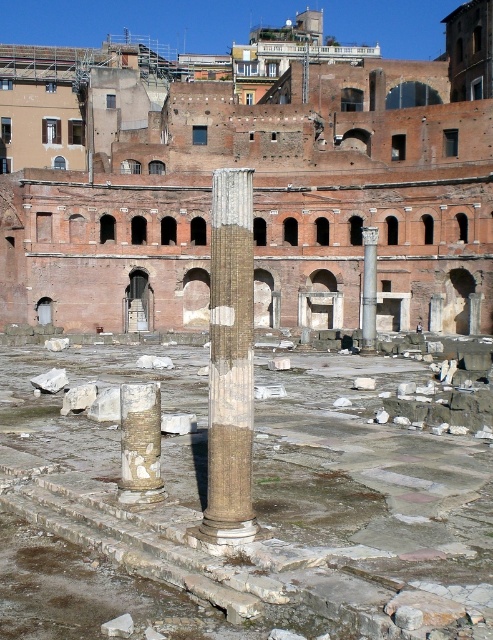
Does brown stone column at center appear on the right side of speckled stone column at center?

Yes, brown stone column at center is to the right of speckled stone column at center.

Does brown stone column at center have a smaller size compared to speckled stone column at center?

No, brown stone column at center is not smaller than speckled stone column at center.

Is point (220, 179) farther from camera compared to point (125, 410)?

No.

Image resolution: width=493 pixels, height=640 pixels. Identify the location of brown stone column at center. (231, 362).

Can you confirm if speckled stone column at center is shorter than smooth stone column at center?

Correct, speckled stone column at center is not as tall as smooth stone column at center.

Between point (155, 474) and point (364, 301), which one is positioned behind?

Positioned behind is point (364, 301).

Which is in front, point (148, 484) or point (367, 282)?

Point (148, 484) is in front.

I want to click on speckled stone column at center, so click(x=140, y=444).

Between point (157, 198) and point (124, 417), which one is positioned in front?

Point (124, 417)

Is brown stone amphitheater at center positioned at the back of speckled stone column at center?

That is True.

Locate an element on the screen. brown stone amphitheater at center is located at coordinates (270, 192).

Locate an element on the screen. This screenshot has width=493, height=640. brown stone amphitheater at center is located at coordinates (270, 192).